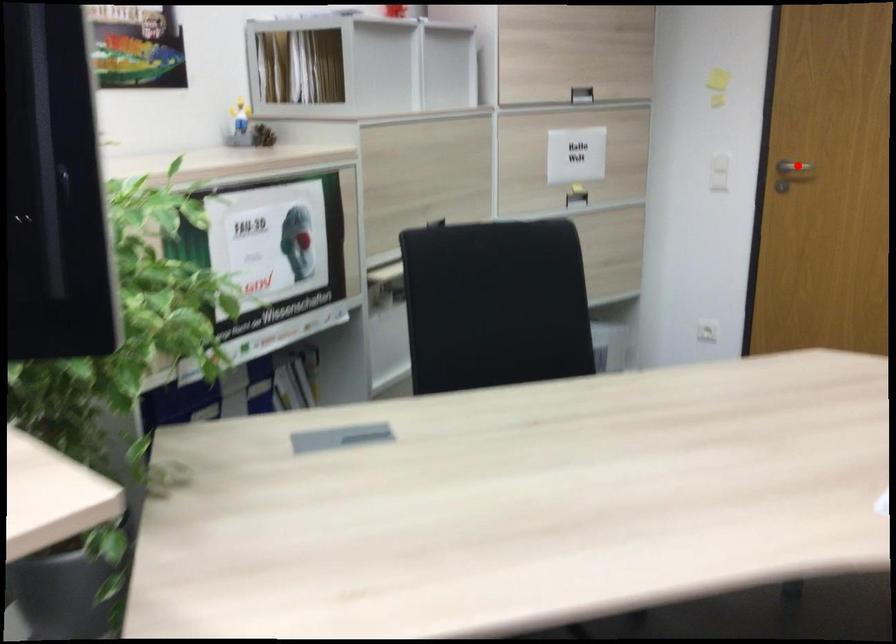
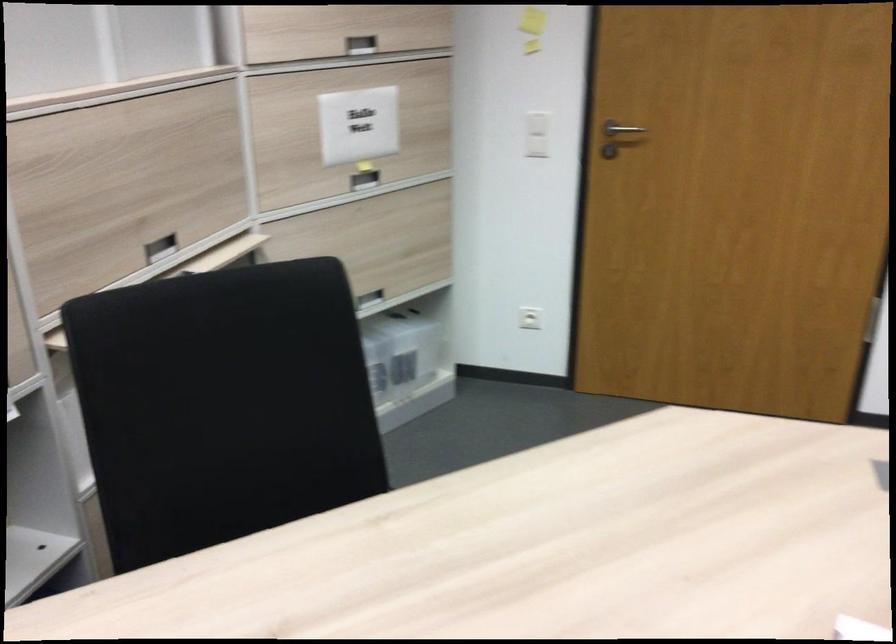
Question: I am providing you with two images of the same scene from different viewpoints. A red point is marked on the first image. At the location where the point appears in image 1, is it still visible in image 2?

Choices:
 (A) Yes
 (B) No

Answer: (A)